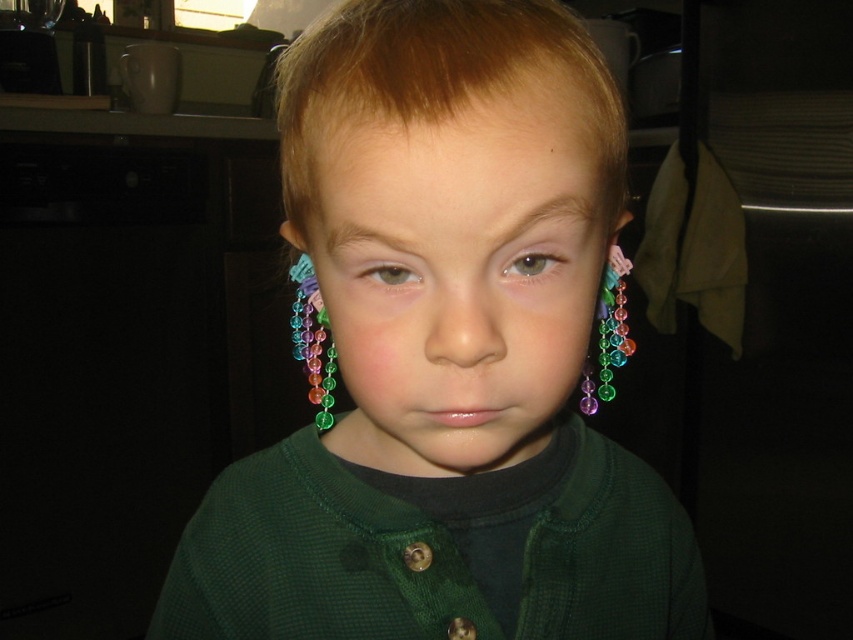
Question: Is blonde shiny hair at center wider than multicolored beads at right ear?

Choices:
 (A) yes
 (B) no

Answer: (A)

Question: Which point is farther to the camera?

Choices:
 (A) (431, 74)
 (B) (521, 259)

Answer: (B)

Question: Which point is closer to the camera taking this photo?

Choices:
 (A) (328, 356)
 (B) (606, 324)

Answer: (B)

Question: Can you confirm if multicolored beads at right ear is positioned to the left of green matte eye at center?

Choices:
 (A) yes
 (B) no

Answer: (B)

Question: Is gray matte eye at center wider than green matte eye at center?

Choices:
 (A) no
 (B) yes

Answer: (B)

Question: Which point is closer to the camera?

Choices:
 (A) (525, 83)
 (B) (397, 268)
 (C) (323, 394)

Answer: (A)